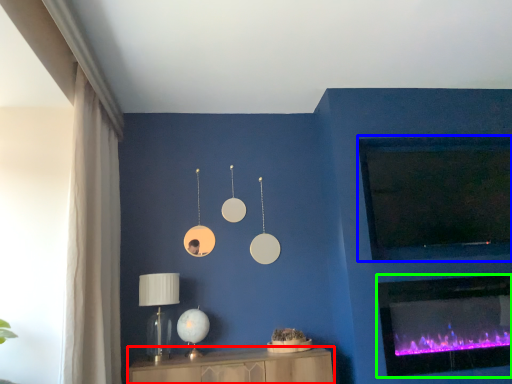
Question: Considering the real-world distances, which object is farthest from furniture (highlighted by a red box)? window screen (highlighted by a blue box) or wood burning stove (highlighted by a green box)?

Choices:
 (A) window screen
 (B) wood burning stove

Answer: (A)